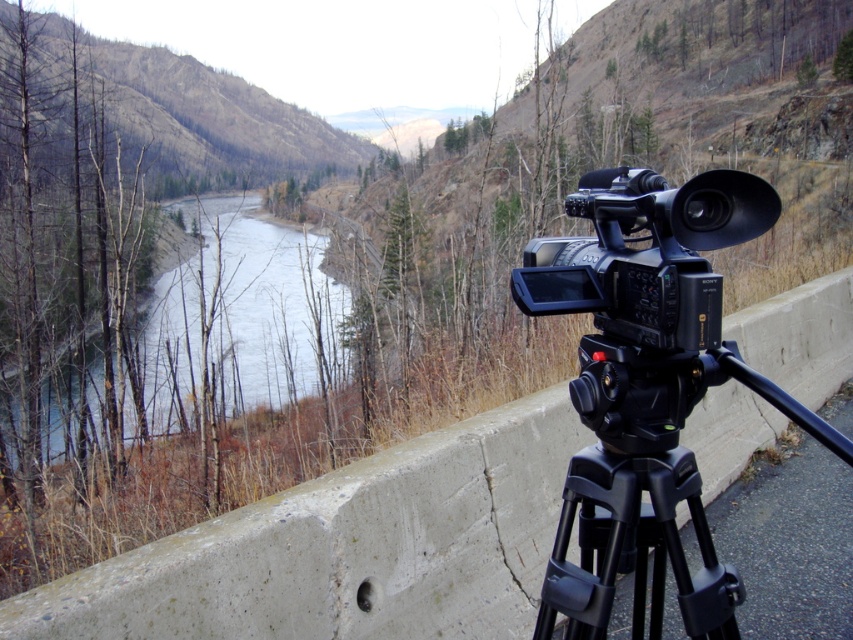
Between point (611, 470) and point (641, 458), which one is positioned behind?

Positioned behind is point (611, 470).

Is point (693, 456) positioned in front of point (550, 596)?

No, (693, 456) is behind (550, 596).

Locate an element on the screen. black matte tripod at lower right is located at coordinates (647, 490).

Where is `black matte tripod at lower right`? The height and width of the screenshot is (640, 853). black matte tripod at lower right is located at coordinates (647, 490).

Can you confirm if clear water at center is bigger than black plastic camera at center?

Correct, clear water at center is larger in size than black plastic camera at center.

Measure the distance between clear water at center and black plastic camera at center.

They are 68.57 feet apart.

What do you see at coordinates (241, 316) in the screenshot?
I see `clear water at center` at bounding box center [241, 316].

What are the coordinates of `clear water at center` in the screenshot? It's located at (241, 316).

Measure the distance between point (526, 442) and camera.

Point (526, 442) and camera are 3.54 meters apart.

What do you see at coordinates (347, 547) in the screenshot? The width and height of the screenshot is (853, 640). I see `concrete ledge at center` at bounding box center [347, 547].

Does point (592, 436) come farther from viewer compared to point (636, 275)?

That is True.

Where is `concrete ledge at center`? concrete ledge at center is located at coordinates (347, 547).